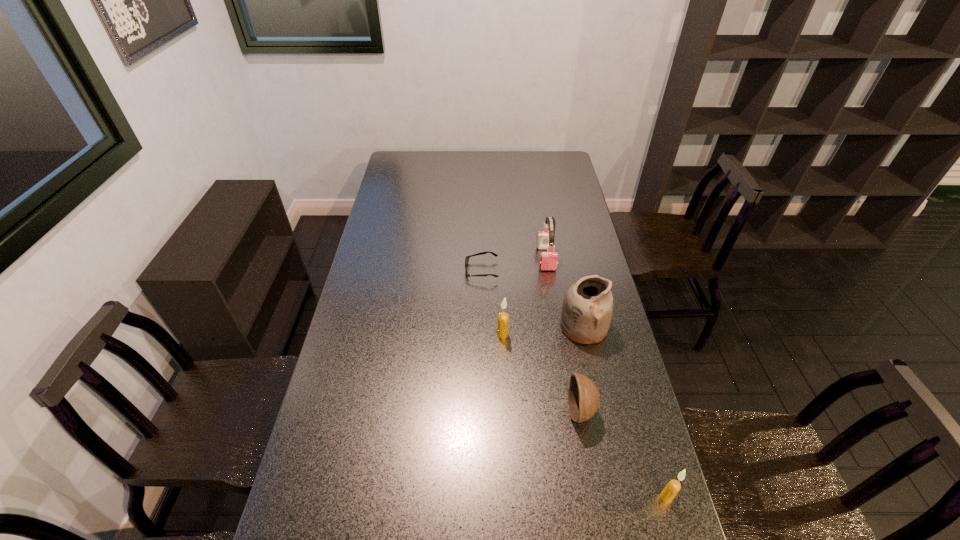
Identify the location of vacant space located on the left of the pottery. The height and width of the screenshot is (540, 960). (527, 327).

Image resolution: width=960 pixels, height=540 pixels. What are the coordinates of `vacant position located 0.130m on the outer surface of the earphone` in the screenshot? It's located at (552, 296).

Identify the location of blank space located 0.120m on the lenses of the sunglasses. The image size is (960, 540). (434, 271).

Image resolution: width=960 pixels, height=540 pixels. In order to click on vacant region located on the lenses of the sunglasses in this screenshot , I will do `click(387, 271)`.

This screenshot has width=960, height=540. In order to click on vacant space located 0.300m on the lenses of the sunglasses in this screenshot , I will do `click(387, 271)`.

The image size is (960, 540). I want to click on free spot located 0.150m on the front of the bowl, so click(x=595, y=489).

What are the coordinates of `object located in the near edge section of the desktop` in the screenshot? It's located at (673, 487).

Locate an element on the screen. This screenshot has width=960, height=540. candle present at the right edge is located at coordinates (673, 487).

You are a GUI agent. You are given a task and a screenshot of the screen. Output one action in this format:
    pyautogui.click(x=<x>, y=<y>)
    Task: Click on the pottery located in the right edge section of the desktop
    The width and height of the screenshot is (960, 540).
    Given the screenshot: What is the action you would take?
    pyautogui.click(x=587, y=308)

Locate an element on the screen. Image resolution: width=960 pixels, height=540 pixels. earphone that is positioned at the right edge is located at coordinates (545, 240).